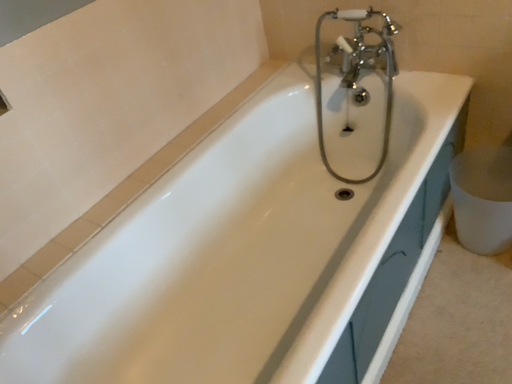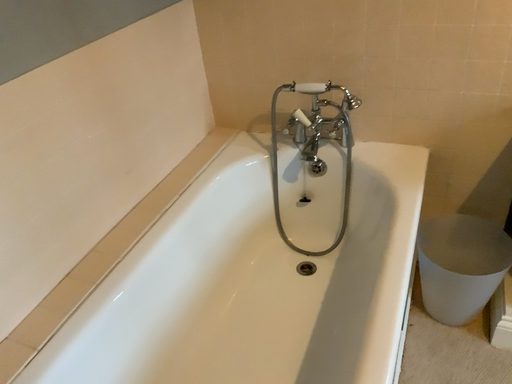
Question: Which way did the camera rotate in the video?

Choices:
 (A) rotated right
 (B) rotated left

Answer: (A)